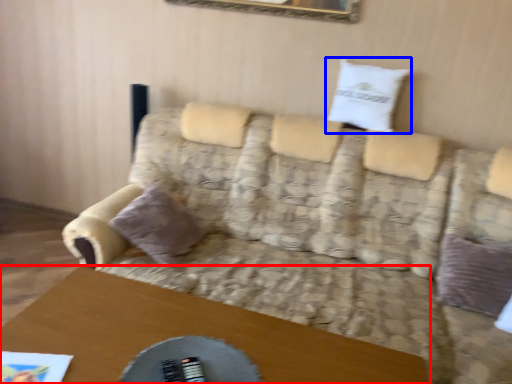
Question: Which point is closer to the camera, table (highlighted by a red box) or pillow (highlighted by a blue box)?

Choices:
 (A) table
 (B) pillow

Answer: (A)